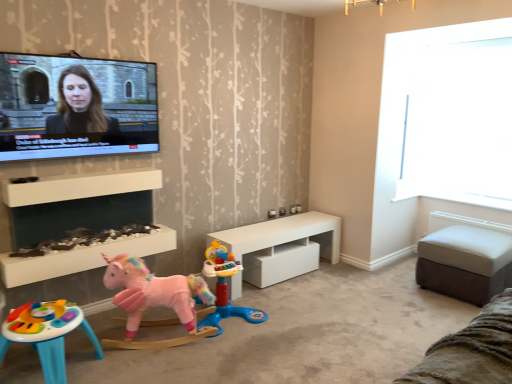
This screenshot has width=512, height=384. What do you see at coordinates (449, 113) in the screenshot? I see `transparent glass window at upper right` at bounding box center [449, 113].

Measure the distance between point (441, 241) and camera.

Point (441, 241) and camera are 3.35 meters apart from each other.

Where is `white glossy fireplace at lower left, which is counted as the 1th shelf, starting from the bottom`? white glossy fireplace at lower left, which is counted as the 1th shelf, starting from the bottom is located at coordinates (81, 187).

Measure the distance between matte black screen at upper left and camera.

The distance of matte black screen at upper left from camera is 7.90 feet.

The image size is (512, 384). I want to click on transparent glass window at upper right, so click(449, 113).

Between brown suede ottoman at lower right and white glossy fireplace at lower left, which is counted as the 1th shelf, starting from the bottom, which one has larger width?

Wider between the two is brown suede ottoman at lower right.

Which shelf is the 2nd one when counting from the back of the brown suede ottoman at lower right? Please provide its 2D coordinates.

[(81, 187)]

In terms of size, does brown suede ottoman at lower right appear bigger or smaller than white glossy fireplace at lower left, marked as the second shelf in a top-to-bottom arrangement?

In the image, brown suede ottoman at lower right appears to be smaller than white glossy fireplace at lower left, marked as the second shelf in a top-to-bottom arrangement.

Is brown suede ottoman at lower right completely or partially outside of white glossy fireplace at lower left, marked as the second shelf in a top-to-bottom arrangement?

Yes, brown suede ottoman at lower right is located beyond the bounds of white glossy fireplace at lower left, marked as the second shelf in a top-to-bottom arrangement.

Does white matte shelf at center, arranged as the 2th shelf when ordered from the bottom, come in front of matte black screen at upper left?

No, white matte shelf at center, arranged as the 2th shelf when ordered from the bottom, is behind matte black screen at upper left.

How different are the orientations of white matte shelf at center, positioned as the first shelf in top-to-bottom order, and matte black screen at upper left in degrees?

The angular difference between white matte shelf at center, positioned as the first shelf in top-to-bottom order, and matte black screen at upper left is 0.000607 degrees.

From a real-world perspective, is white matte shelf at center, arranged as the 2th shelf when ordered from the bottom, positioned above or below matte black screen at upper left?

From a real-world perspective, white matte shelf at center, arranged as the 2th shelf when ordered from the bottom, is physically below matte black screen at upper left.

Is transparent glass window at upper right to the right of brown suede ottoman at lower right from the viewer's perspective?

Yes, transparent glass window at upper right is to the right of brown suede ottoman at lower right.

Does transparent glass window at upper right lie behind brown suede ottoman at lower right?

Yes, it is behind brown suede ottoman at lower right.

Which of these two, transparent glass window at upper right or brown suede ottoman at lower right, stands shorter?

brown suede ottoman at lower right.

Is white leather ottoman at right, which is the first table in right-to-left order, aimed at transparent glass window at upper right?

No, white leather ottoman at right, which is the first table in right-to-left order, is not aimed at transparent glass window at upper right.

Who is bigger, white leather ottoman at right, arranged as the 2th table when viewed from the left, or transparent glass window at upper right?

white leather ottoman at right, arranged as the 2th table when viewed from the left.

From the image's perspective, is white leather ottoman at right, which is the first table in right-to-left order, located above transparent glass window at upper right?

Incorrect, from the image's perspective, white leather ottoman at right, which is the first table in right-to-left order, is lower than transparent glass window at upper right.

From the picture: Between white leather ottoman at right, arranged as the 2th table when viewed from the left, and transparent glass window at upper right, which one has less height?

white leather ottoman at right, arranged as the 2th table when viewed from the left, is shorter.

Does pink fabric unicorn at lower left, which is the first toy in right-to-left order, turn towards white leather ottoman at right, arranged as the 2th table when viewed from the left?

No, pink fabric unicorn at lower left, which is the first toy in right-to-left order, is not oriented towards white leather ottoman at right, arranged as the 2th table when viewed from the left.

From the image's perspective, between pink fabric unicorn at lower left, the third toy in the left-to-right sequence, and white leather ottoman at right, arranged as the 2th table when viewed from the left, who is located below?

pink fabric unicorn at lower left, the third toy in the left-to-right sequence, from the image's perspective.

How different are the orientations of pink fabric unicorn at lower left, the third toy in the left-to-right sequence, and white leather ottoman at right, arranged as the 2th table when viewed from the left, in degrees?

79.5 degrees separate the facing orientations of pink fabric unicorn at lower left, the third toy in the left-to-right sequence, and white leather ottoman at right, arranged as the 2th table when viewed from the left.

Is plastic colorful table at lower left, the third toy from the right, wider or thinner than pink fabric unicorn at lower left, which is the first toy in right-to-left order?

Considering their sizes, plastic colorful table at lower left, the third toy from the right, looks broader than pink fabric unicorn at lower left, which is the first toy in right-to-left order.

Is point (12, 336) closer or farther from the camera than point (234, 266)?

Point (12, 336).

From a real-world perspective, is plastic colorful table at lower left, which is the first toy in left-to-right order, under pink fabric unicorn at lower left, the third toy in the left-to-right sequence?

Yes, from a real-world perspective, plastic colorful table at lower left, which is the first toy in left-to-right order, is under pink fabric unicorn at lower left, the third toy in the left-to-right sequence.

Image resolution: width=512 pixels, height=384 pixels. I want to click on the 1st shelf in front when counting from the pink plush unicorn at lower left, arranged as the second toy when viewed from the left, so click(81, 187).

Consider the image. Considering the sizes of pink plush unicorn at lower left, acting as the second toy starting from the right, and white glossy fireplace at lower left, marked as the second shelf in a top-to-bottom arrangement, in the image, is pink plush unicorn at lower left, acting as the second toy starting from the right, taller or shorter than white glossy fireplace at lower left, marked as the second shelf in a top-to-bottom arrangement,?

In the image, pink plush unicorn at lower left, acting as the second toy starting from the right, appears to be taller than white glossy fireplace at lower left, marked as the second shelf in a top-to-bottom arrangement.

Considering the positions of objects pink plush unicorn at lower left, acting as the second toy starting from the right, and white glossy fireplace at lower left, which is counted as the 1th shelf, starting from the bottom, in the image provided, who is behind, pink plush unicorn at lower left, acting as the second toy starting from the right, or white glossy fireplace at lower left, which is counted as the 1th shelf, starting from the bottom,?

pink plush unicorn at lower left, acting as the second toy starting from the right.

Is pink plush unicorn at lower left, arranged as the second toy when viewed from the left, facing away from white glossy fireplace at lower left, which is counted as the 1th shelf, starting from the bottom?

That's not correct — pink plush unicorn at lower left, arranged as the second toy when viewed from the left, is not looking away from white glossy fireplace at lower left, which is counted as the 1th shelf, starting from the bottom.

Find the location of a particular element. This screenshot has height=384, width=512. couch lying below the white glossy fireplace at lower left, which is counted as the 1th shelf, starting from the bottom (from the image's perspective) is located at coordinates (471, 350).

Image resolution: width=512 pixels, height=384 pixels. I want to click on television lying above the white matte shelf at center, arranged as the 2th shelf when ordered from the bottom (from the image's perspective), so tap(75, 106).

Consider the image. Based on their spatial positions, is brown suede ottoman at lower right or white leather ottoman at right, arranged as the 2th table when viewed from the left, closer to transparent glass window at upper right?

white leather ottoman at right, arranged as the 2th table when viewed from the left, is positioned closer to the anchor transparent glass window at upper right.

Considering their positions, is matte black screen at upper left positioned closer to white glossy table at center, which is the 1th table from left to right, than white leather ottoman at right, arranged as the 2th table when viewed from the left?

white leather ottoman at right, arranged as the 2th table when viewed from the left, is closer to white glossy table at center, which is the 1th table from left to right.

Based on their spatial positions, is white leather ottoman at right, which is the first table in right-to-left order, or pink fabric unicorn at lower left, the third toy in the left-to-right sequence, further from plastic colorful table at lower left, which is the first toy in left-to-right order?

white leather ottoman at right, which is the first table in right-to-left order, is further to plastic colorful table at lower left, which is the first toy in left-to-right order.

When comparing their distances from pink fabric unicorn at lower left, which is the first toy in right-to-left order, does pink plush unicorn at lower left, acting as the second toy starting from the right, or white leather ottoman at right, which is the first table in right-to-left order, seem further?

Among the two, white leather ottoman at right, which is the first table in right-to-left order, is located further to pink fabric unicorn at lower left, which is the first toy in right-to-left order.

Estimate the real-world distances between objects in this image. Which object is further from white matte shelf at center, positioned as the first shelf in top-to-bottom order, white leather ottoman at right, which is the first table in right-to-left order, or brown suede ottoman at lower right?

white leather ottoman at right, which is the first table in right-to-left order, lies further to white matte shelf at center, positioned as the first shelf in top-to-bottom order, than the other object.

Consider the image. From the image, which object appears to be farther from white matte shelf at center, positioned as the first shelf in top-to-bottom order, pink fabric unicorn at lower left, which is the first toy in right-to-left order, or white leather ottoman at right, arranged as the 2th table when viewed from the left?

white leather ottoman at right, arranged as the 2th table when viewed from the left, is further to white matte shelf at center, positioned as the first shelf in top-to-bottom order.

When comparing their distances from matte black screen at upper left, does white matte shelf at center, arranged as the 2th shelf when ordered from the bottom, or brown suede ottoman at lower right seem closer?

The object closer to matte black screen at upper left is white matte shelf at center, arranged as the 2th shelf when ordered from the bottom.

Considering their positions, is white glossy table at center, which is the 1th table from left to right, positioned closer to matte black screen at upper left than white matte shelf at center, positioned as the first shelf in top-to-bottom order?

white matte shelf at center, positioned as the first shelf in top-to-bottom order, is closer to matte black screen at upper left.

Identify the location of toy situated between pink plush unicorn at lower left, arranged as the second toy when viewed from the left, and transparent glass window at upper right from left to right. The width and height of the screenshot is (512, 384). (225, 288).

Where is `toy situated between white matte shelf at center, positioned as the first shelf in top-to-bottom order, and pink fabric unicorn at lower left, the third toy in the left-to-right sequence, from left to right`? toy situated between white matte shelf at center, positioned as the first shelf in top-to-bottom order, and pink fabric unicorn at lower left, the third toy in the left-to-right sequence, from left to right is located at coordinates (152, 300).

This screenshot has height=384, width=512. I want to click on table between white glossy fireplace at lower left, marked as the second shelf in a top-to-bottom arrangement, and white leather ottoman at right, which is the first table in right-to-left order, so click(x=280, y=248).

Where is `shelf between white matte shelf at center, arranged as the 2th shelf when ordered from the bottom, and pink plush unicorn at lower left, arranged as the second toy when viewed from the left, from top to bottom`? The width and height of the screenshot is (512, 384). shelf between white matte shelf at center, arranged as the 2th shelf when ordered from the bottom, and pink plush unicorn at lower left, arranged as the second toy when viewed from the left, from top to bottom is located at coordinates (81, 187).